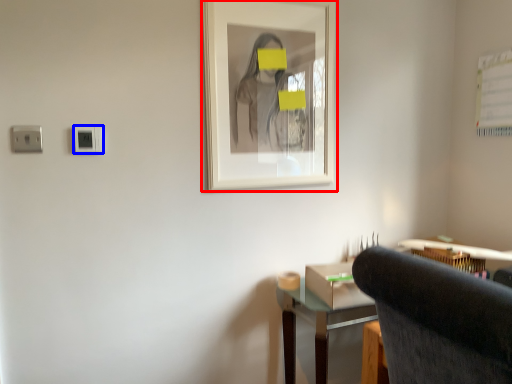
Question: Among these objects, which one is nearest to the camera, picture frame (highlighted by a red box) or electric outlet (highlighted by a blue box)?

Choices:
 (A) picture frame
 (B) electric outlet

Answer: (B)